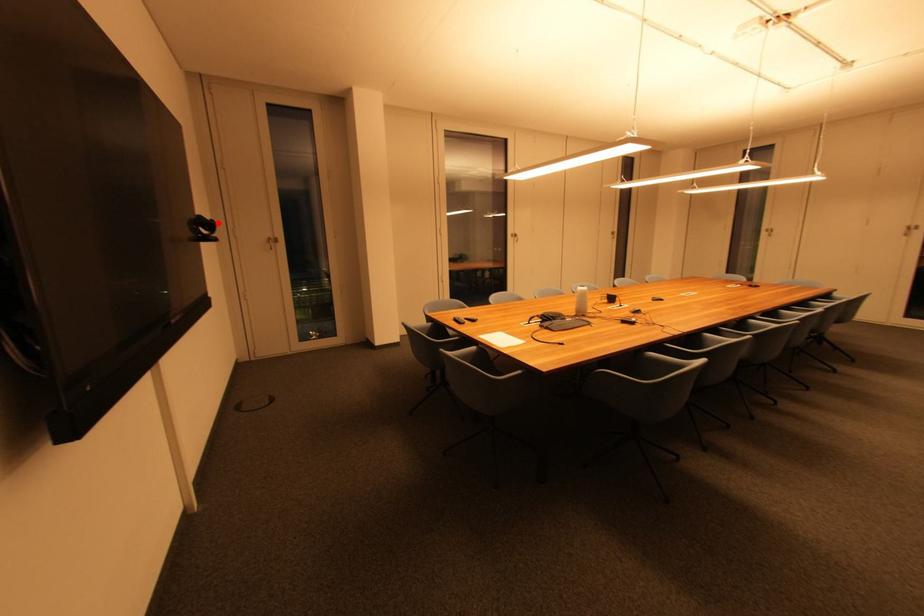
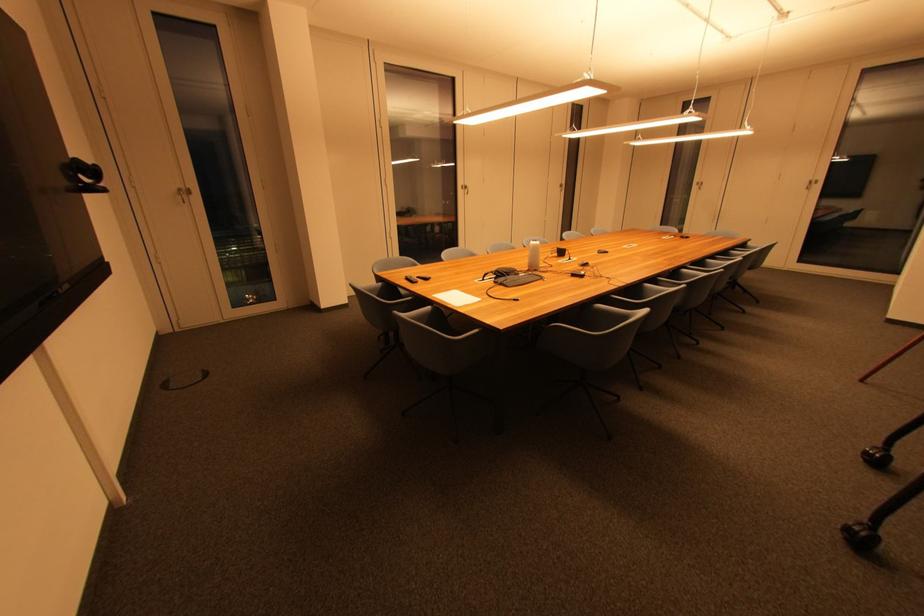
The point at the highlighted location is marked in the first image. Where is the corresponding point in the second image?

(101, 168)